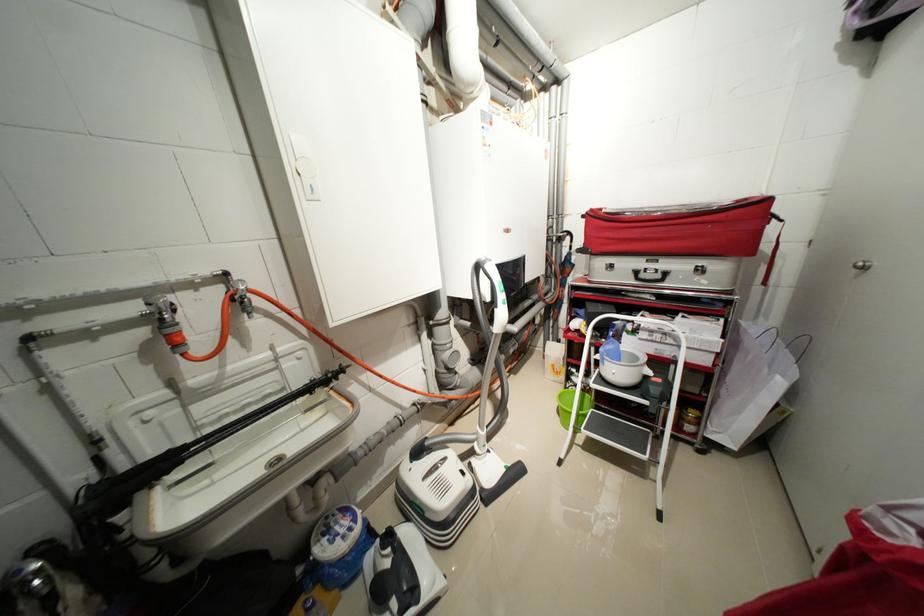
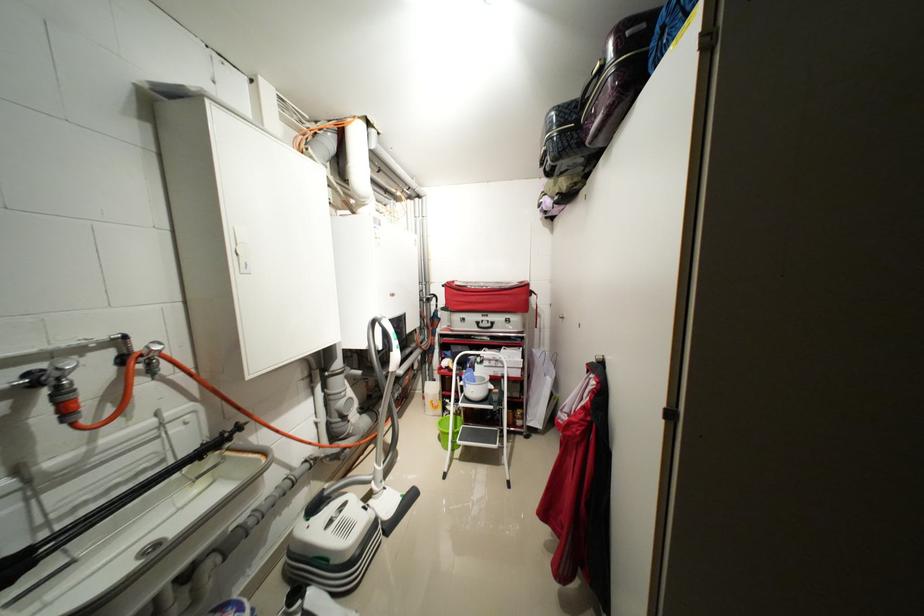
Question: I am providing you with two images of the same scene from different viewpoints. After the viewpoint changes to image2, which objects are now occluded?

Choices:
 (A) black valve handle
 (B) silver suitcase
 (C) black patterned suitcase
 (D) none of these

Answer: (D)